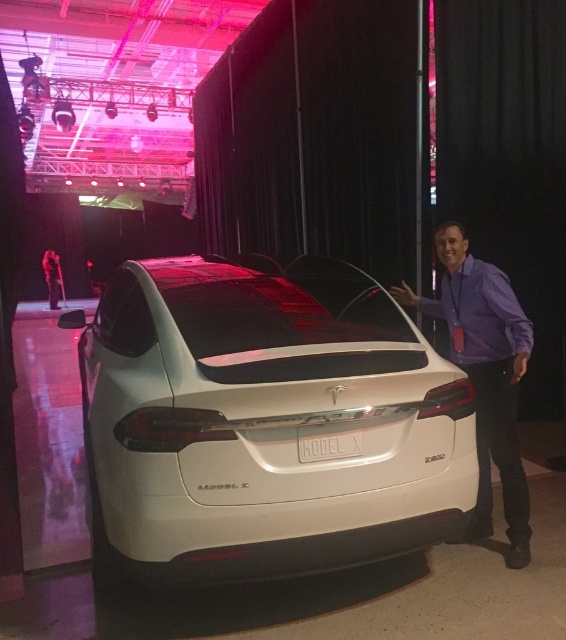
Is white glossy car at center smaller than purple shirt at right?

Incorrect, white glossy car at center is not smaller in size than purple shirt at right.

Where is `white glossy car at center`? The image size is (566, 640). white glossy car at center is located at coordinates (264, 422).

This screenshot has width=566, height=640. In order to click on white glossy car at center in this screenshot , I will do `click(264, 422)`.